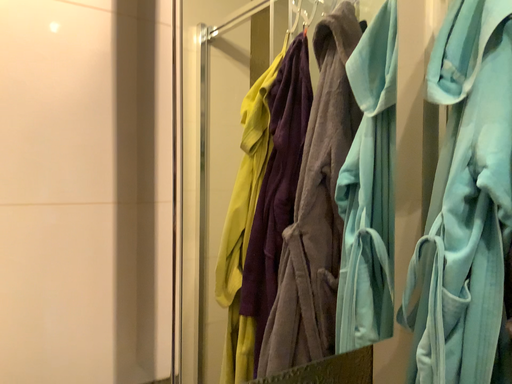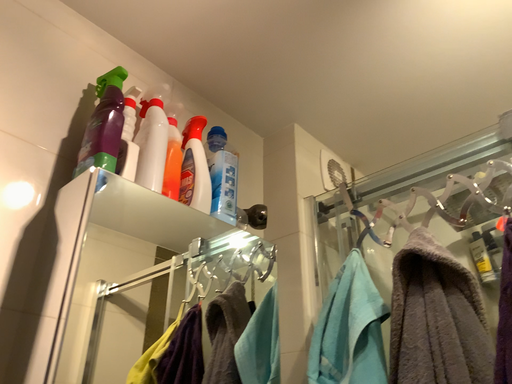
Question: Which way did the camera rotate in the video?

Choices:
 (A) rotated downward
 (B) rotated upward

Answer: (B)